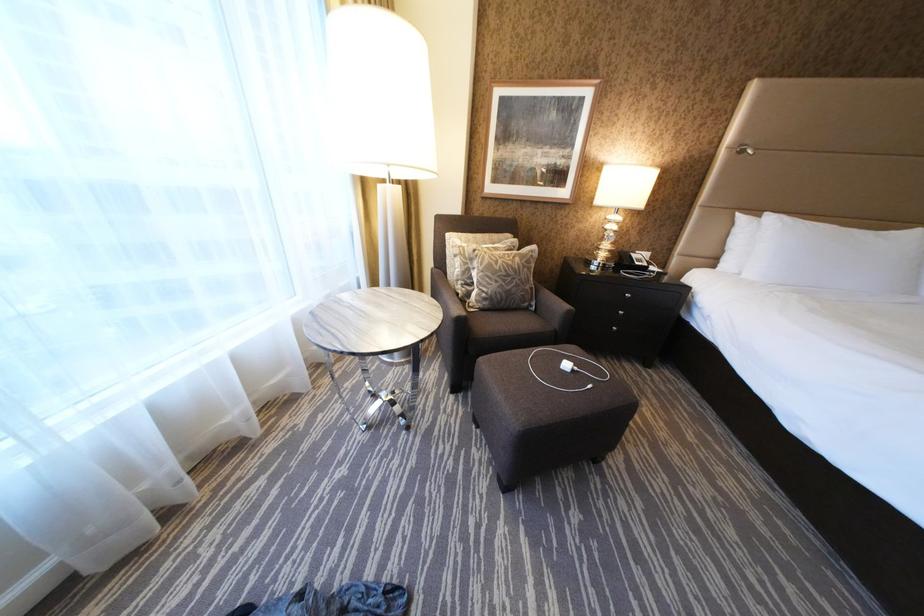
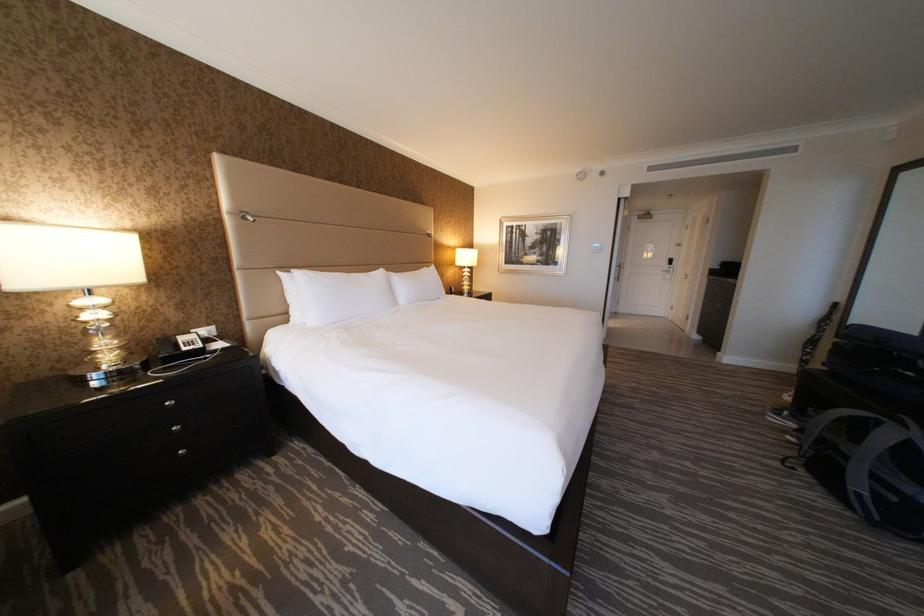
Question: How did the camera likely rotate?

Choices:
 (A) Left
 (B) Right
 (C) Up
 (D) Down

Answer: (B)